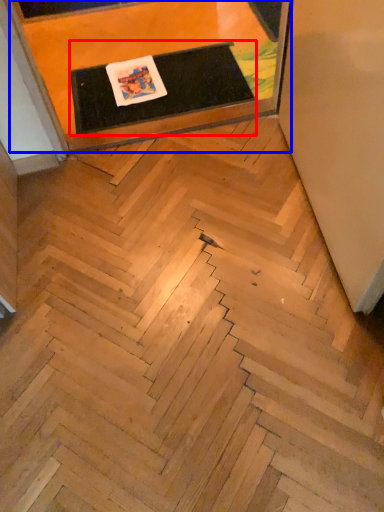
Question: Which object appears closest to the camera in this image, table (highlighted by a red box) or furniture (highlighted by a blue box)?

Choices:
 (A) table
 (B) furniture

Answer: (B)